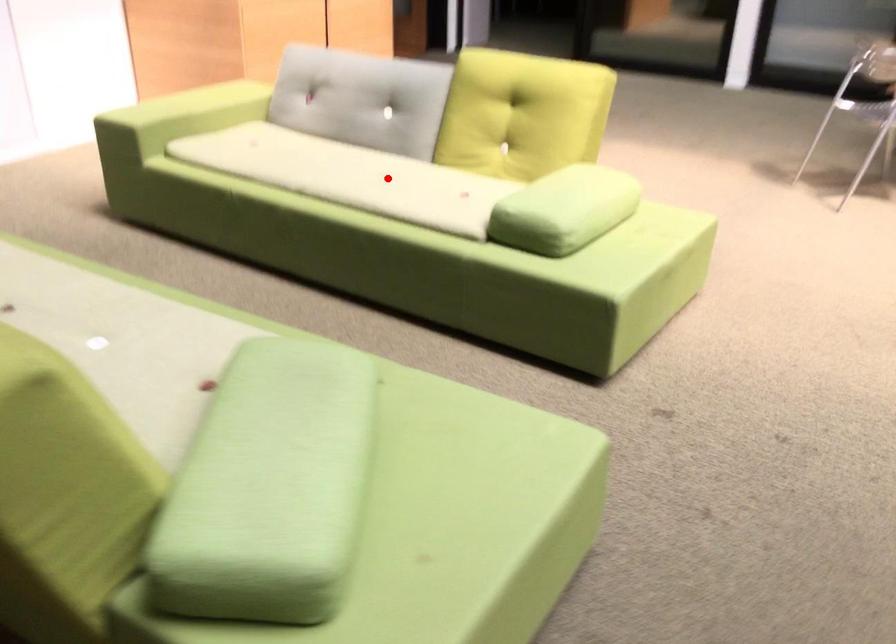
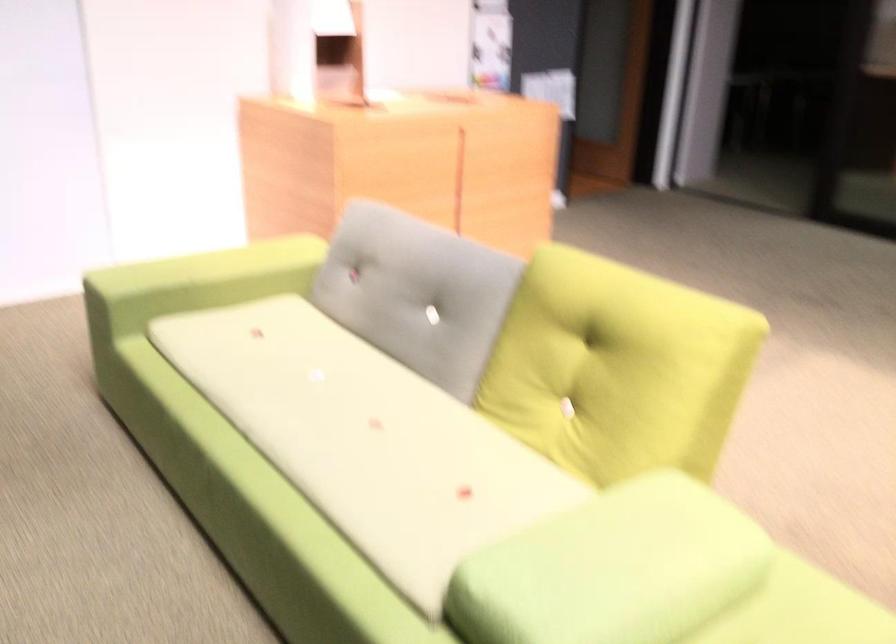
Where in the second image is the point corresponding to the highlighted location from the first image?

(366, 439)